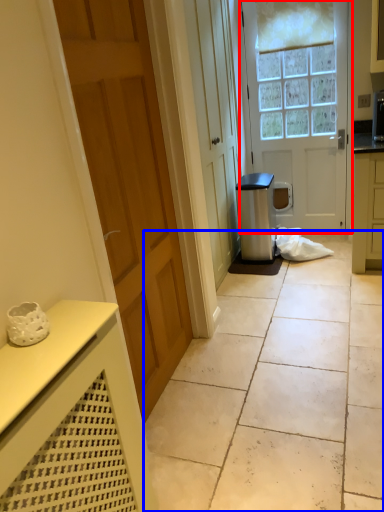
Question: Which object is further to the camera taking this photo, door (highlighted by a red box) or concrete (highlighted by a blue box)?

Choices:
 (A) door
 (B) concrete

Answer: (A)